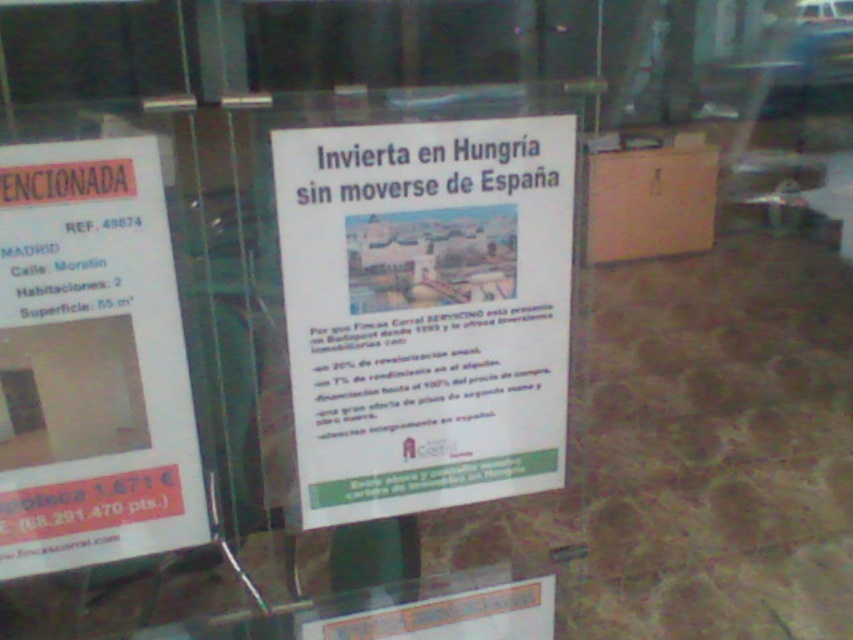
From the picture: Between white paper poster at center and white paper poster at left, which one appears on the left side from the viewer's perspective?

white paper poster at left

Which is above, white paper poster at center or white paper poster at left?

white paper poster at center is above.

In order to click on white paper poster at center in this screenshot , I will do `click(425, 310)`.